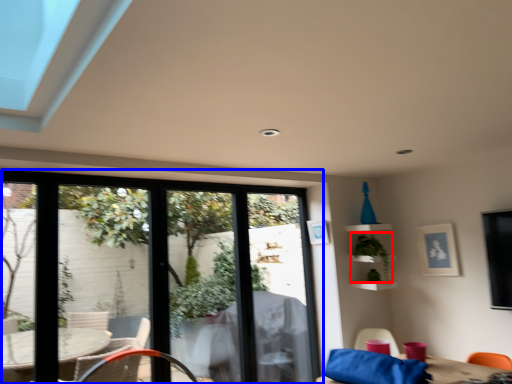
Question: Which object is closer to the camera taking this photo, plant (highlighted by a red box) or window (highlighted by a blue box)?

Choices:
 (A) plant
 (B) window

Answer: (B)